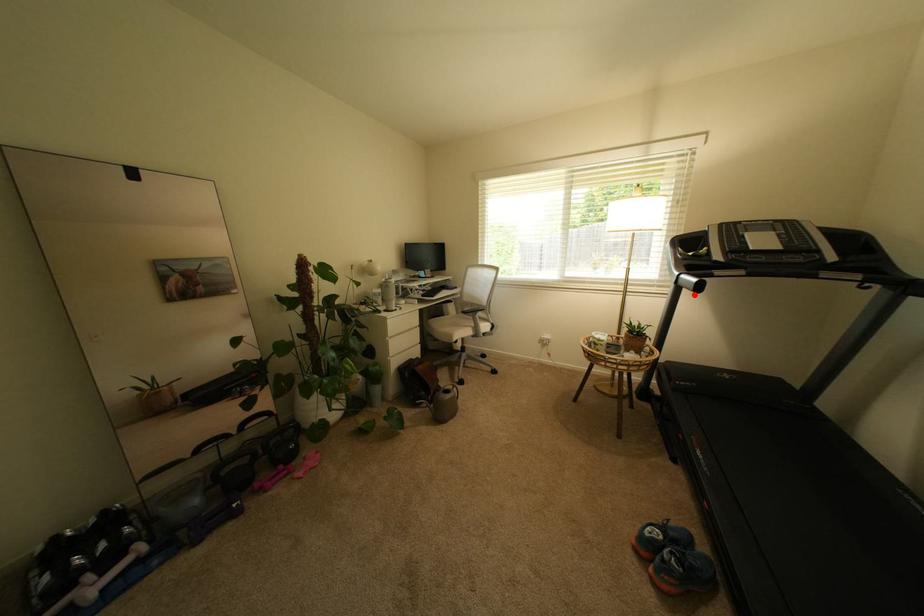
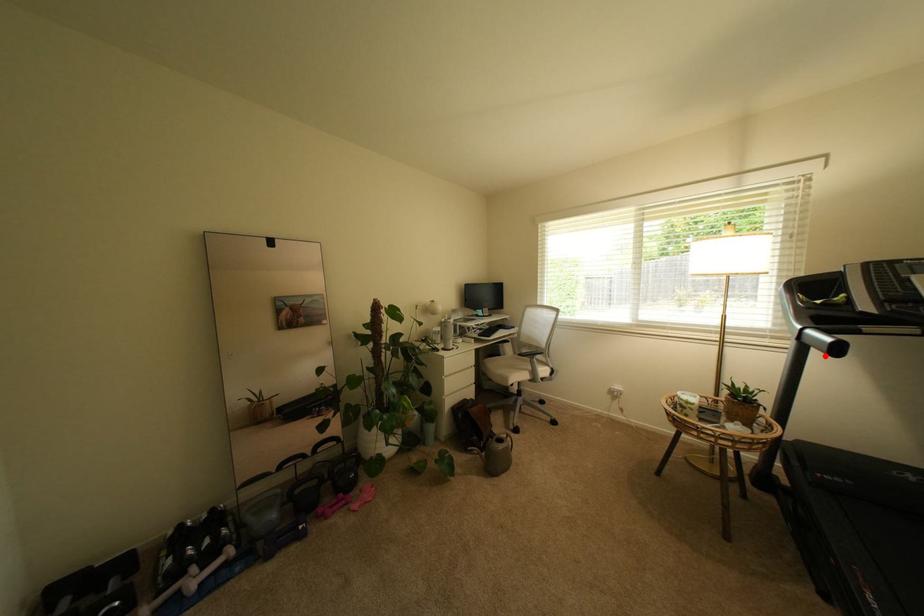
I am providing you with two images of the same scene from different viewpoints. A red point is marked on the first image and another point is marked on the second image. Is the red point in image1 aligned with the point shown in image2?

Yes